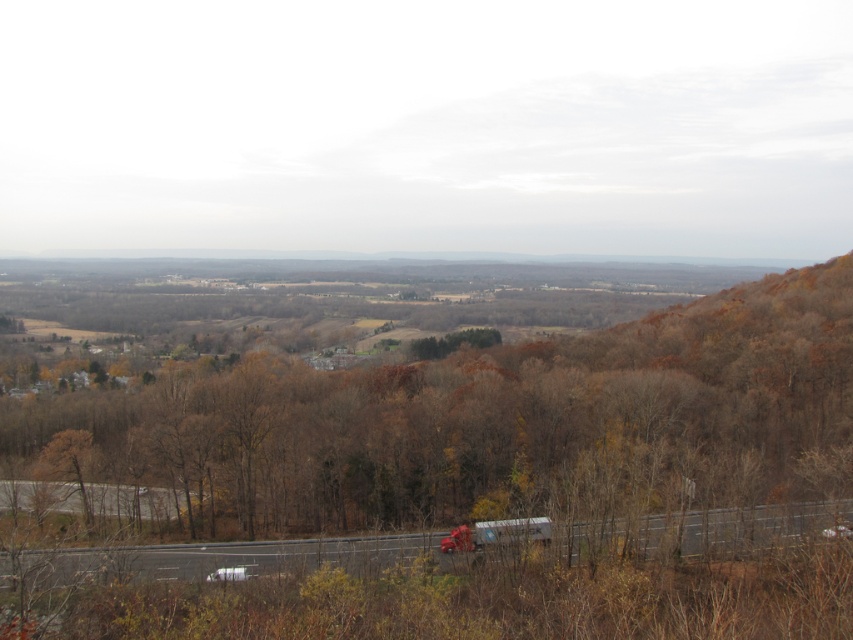
You are standing at the point with coordinates point (361,445) and want to walk towards the point with coordinates point (598,522). Since both points are on the road, will you be moving towards the background or the foreground of the image?

Since point (361,445) is closer to the viewer than point (598,522), moving from point (361,445) to point (598,522) means you are moving towards the background of the image.

You are driving a car and see the brown matte tree at center and the metallic silver truck at lower center ahead on the road. Which object is closer to you?

The brown matte tree at center is closer to you because it is positioned further to the viewer than the metallic silver truck at lower center.